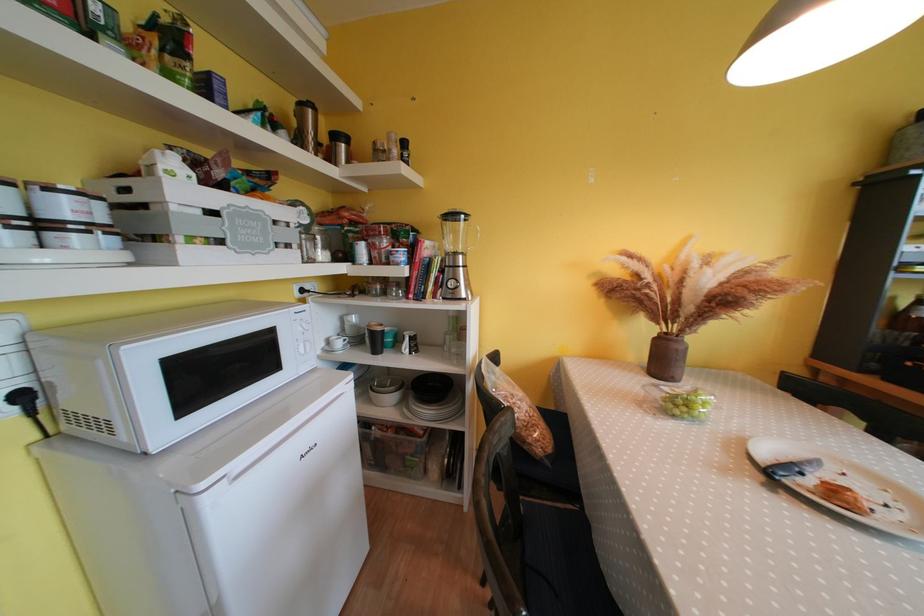
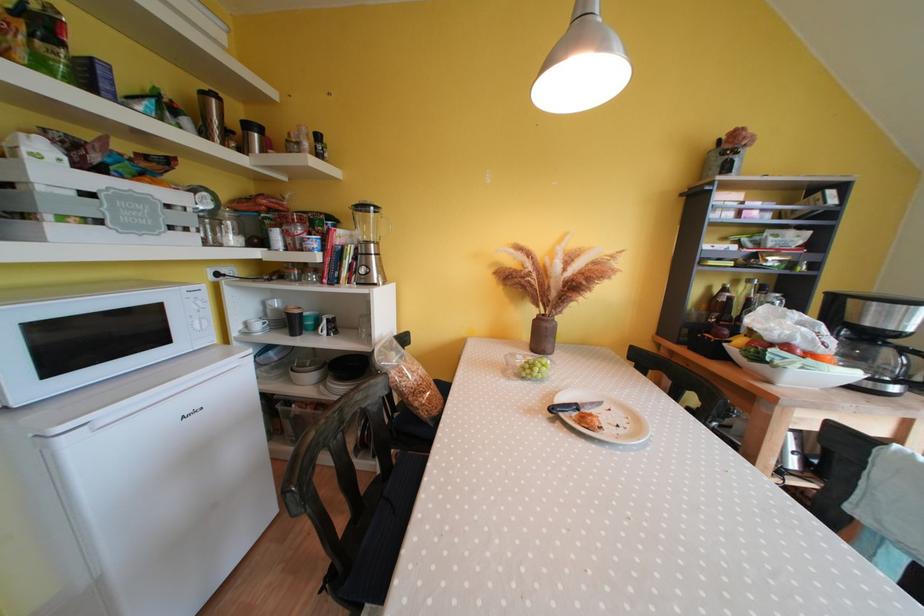
Where in the second image is the point corresponding to (308,108) from the first image?

(209, 98)